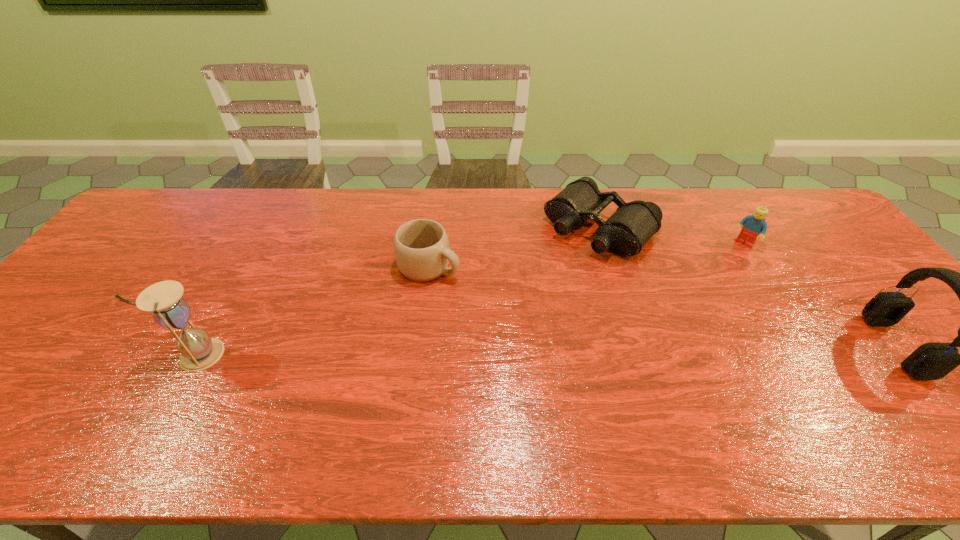
The image size is (960, 540). What are the coordinates of `object that is at the right edge` in the screenshot? It's located at (931, 361).

The image size is (960, 540). Identify the location of object that is at the near right corner. (931, 361).

Identify the location of vacant space at the far edge. The width and height of the screenshot is (960, 540). (274, 224).

Identify the location of vacant space at the near edge of the desktop. (398, 396).

Image resolution: width=960 pixels, height=540 pixels. I want to click on vacant region at the left edge of the desktop, so click(24, 368).

In order to click on free space at the right edge of the desktop in this screenshot , I will do `click(896, 326)`.

In the image, there is a desktop. Identify the location of vacant space at the far left corner. The height and width of the screenshot is (540, 960). (168, 208).

In order to click on free space between the fourth object from right to left and the headset in this screenshot , I will do pos(662,306).

Locate an element on the screen. The width and height of the screenshot is (960, 540). unoccupied position between the hourglass and the mug is located at coordinates (314, 310).

Locate an element on the screen. The height and width of the screenshot is (540, 960). empty space that is in between the Lego and the hourglass is located at coordinates click(470, 299).